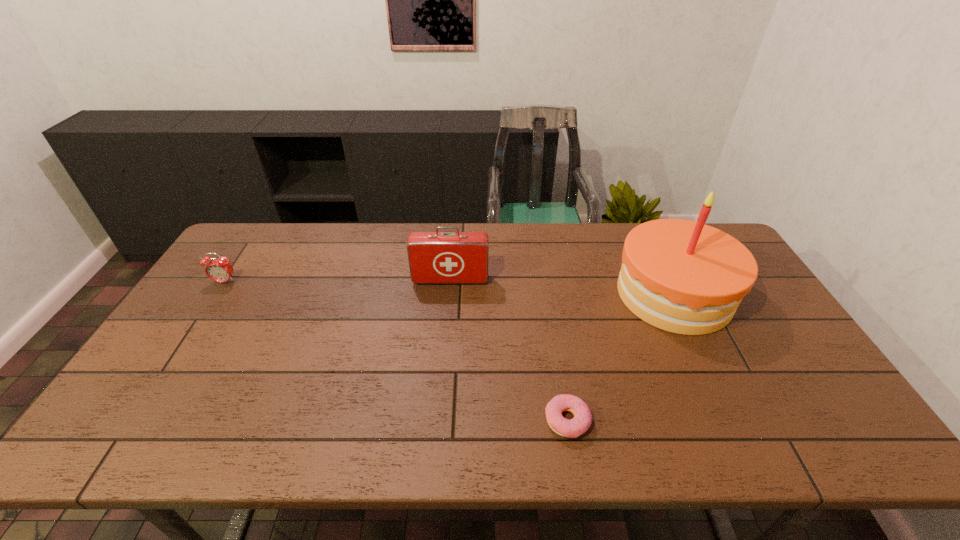
The image size is (960, 540). I want to click on free location at the right edge, so click(732, 332).

Locate an element on the screen. free point between the leftmost object and the second tallest object is located at coordinates (338, 281).

Where is `free spot between the leftmost object and the first-aid kit`? free spot between the leftmost object and the first-aid kit is located at coordinates point(338,281).

Find the location of a particular element. The width and height of the screenshot is (960, 540). vacant area that lies between the birthday cake and the third object from left to right is located at coordinates (620, 357).

Locate an element on the screen. blank region between the leftmost object and the second tallest object is located at coordinates (338, 281).

Locate an element on the screen. free space that is in between the rightmost object and the leftmost object is located at coordinates pos(449,288).

At what (x,y) coordinates should I click in order to perform the action: click on free space between the second object from left to right and the rightmost object. Please return your answer as a coordinate pair (x, y). This screenshot has height=540, width=960. Looking at the image, I should click on (562, 287).

The image size is (960, 540). Identify the location of free space that is in between the second tallest object and the alarm clock. (338, 281).

Image resolution: width=960 pixels, height=540 pixels. What are the coordinates of `free point between the tallest object and the leftmost object` in the screenshot? It's located at (449, 288).

Identify the location of vacant space in between the doughnut and the third tallest object. The width and height of the screenshot is (960, 540). (396, 351).